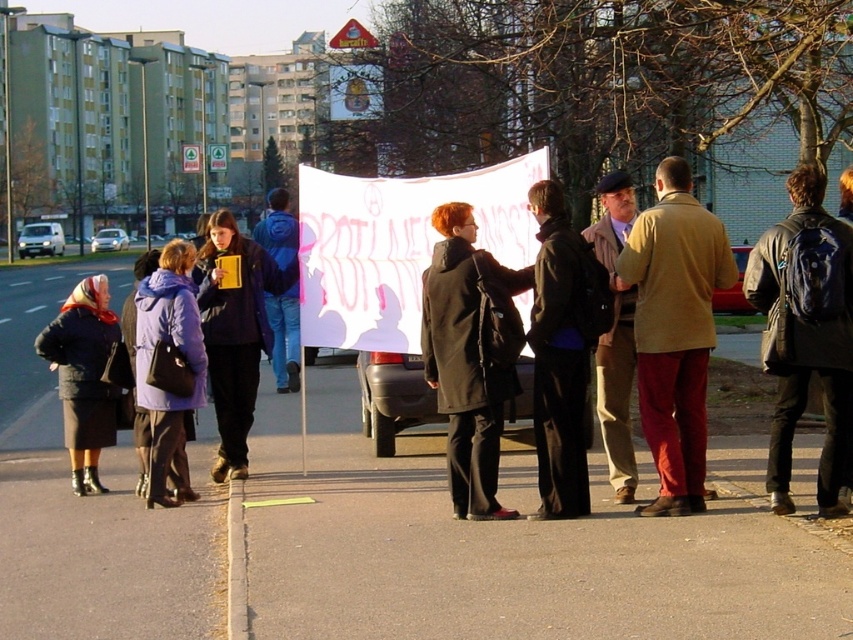
Measure the distance between matte black jacket at center and camera.

matte black jacket at center is 9.36 meters from camera.

Measure the distance from matte black jacket at center to purple fleece jacket at left.

They are 25.14 inches apart.

Locate an element on the screen. The height and width of the screenshot is (640, 853). matte black jacket at center is located at coordinates (235, 332).

Locate an element on the screen. The height and width of the screenshot is (640, 853). matte black jacket at center is located at coordinates (235, 332).

Is khaki woolen coat at center shorter than matte black jacket at center?

In fact, khaki woolen coat at center may be taller than matte black jacket at center.

Looking at this image, can you confirm if khaki woolen coat at center is bigger than matte black jacket at center?

Correct, khaki woolen coat at center is larger in size than matte black jacket at center.

Describe the element at coordinates (674, 330) in the screenshot. I see `khaki woolen coat at center` at that location.

The height and width of the screenshot is (640, 853). I want to click on khaki woolen coat at center, so click(674, 330).

Is point (215, 344) closer to viewer compared to point (276, 195)?

Yes, it is in front of point (276, 195).

Does point (260, 305) come behind point (297, 317)?

No.

You are a GUI agent. You are given a task and a screenshot of the screen. Output one action in this format:
    pyautogui.click(x=<x>, y=<y>)
    Task: Click on the matte black jacket at center
    
    Given the screenshot: What is the action you would take?
    pyautogui.click(x=235, y=332)